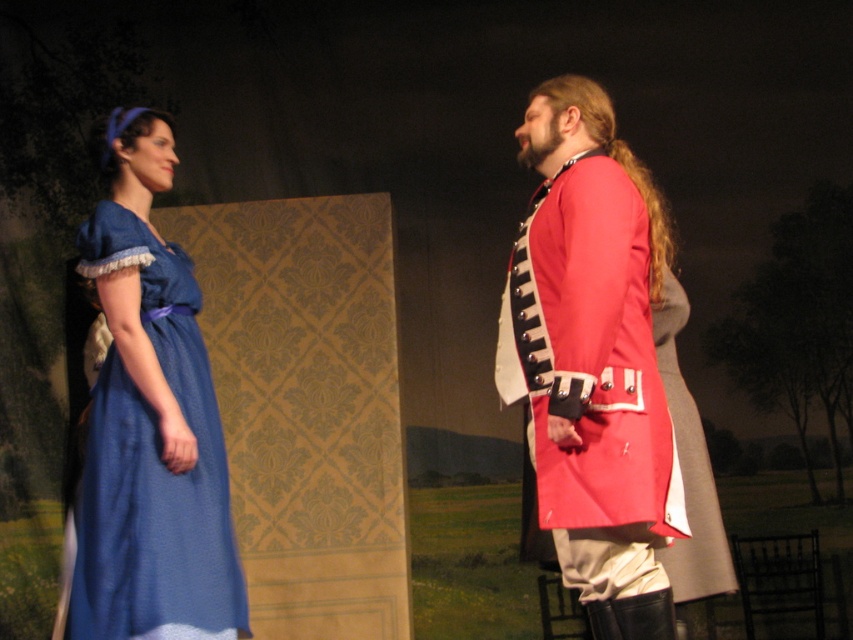
Question: Which object is farther from the camera taking this photo?

Choices:
 (A) shiny red coat at center
 (B) matte blue dress at left

Answer: (B)

Question: Is shiny red coat at center further to the viewer compared to matte blue dress at left?

Choices:
 (A) no
 (B) yes

Answer: (A)

Question: Is shiny red coat at center thinner than matte blue dress at left?

Choices:
 (A) no
 (B) yes

Answer: (A)

Question: Among these objects, which one is nearest to the camera?

Choices:
 (A) matte blue dress at left
 (B) shiny red coat at center

Answer: (B)

Question: Which point is farther from the camera taking this photo?

Choices:
 (A) (550, 173)
 (B) (83, 518)

Answer: (A)

Question: Can you confirm if shiny red coat at center is wider than matte blue dress at left?

Choices:
 (A) yes
 (B) no

Answer: (A)